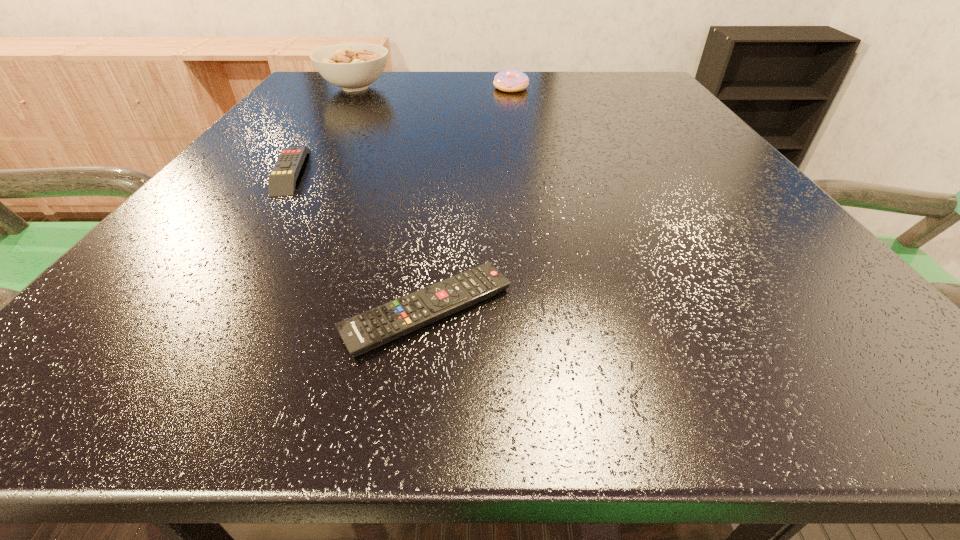
I want to click on stew, so click(353, 66).

Locate an element on the screen. The height and width of the screenshot is (540, 960). doughnut is located at coordinates (507, 80).

Identify the location of the left remote control. (282, 180).

Image resolution: width=960 pixels, height=540 pixels. In order to click on the second shortest object in this screenshot , I will do `click(282, 180)`.

This screenshot has height=540, width=960. I want to click on the nearer remote control, so click(366, 331).

Where is `the shortest object`? The width and height of the screenshot is (960, 540). the shortest object is located at coordinates (366, 331).

The width and height of the screenshot is (960, 540). In order to click on free space located 0.270m on the front of the stew in this screenshot , I will do `click(311, 157)`.

Locate an element on the screen. The height and width of the screenshot is (540, 960). free spot located 0.380m on the left of the doughnut is located at coordinates (325, 88).

The width and height of the screenshot is (960, 540). Find the location of `blank space located on the front of the third farthest object`. blank space located on the front of the third farthest object is located at coordinates (215, 284).

Where is `free space located on the back of the shortest object`? free space located on the back of the shortest object is located at coordinates (446, 164).